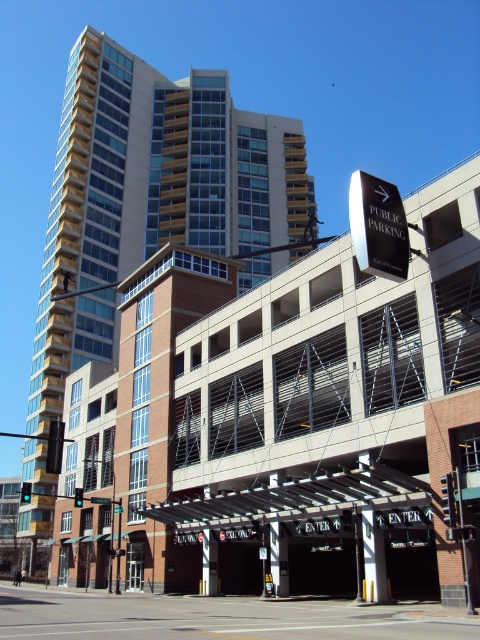
You are a delivery driver approaching the entrance of the concrete parking garage at center and the beige glass building at center. Which structure is wider from your perspective?

The beige glass building at center is wider than the concrete parking garage at center from your perspective.

You are driving a car and want to enter the parking garage. Based on the image, which direction should you head towards from the beige glass building at center to reach the concrete parking garage at center?

The concrete parking garage at center is in front of the beige glass building at center, so you should head towards the direction where the concrete parking garage at center is located, which is in front of the beige glass building at center.